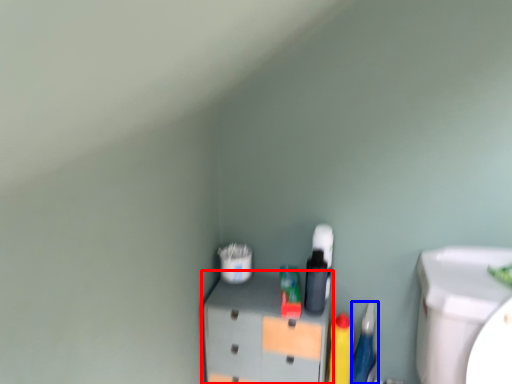
Question: Which point is further to the camera, furniture (highlighted by a red box) or stationery (highlighted by a blue box)?

Choices:
 (A) furniture
 (B) stationery

Answer: (B)